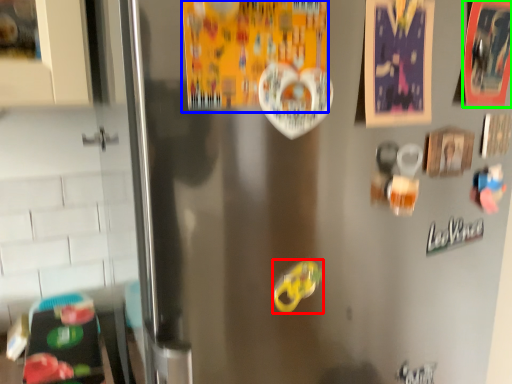
Question: Which object is positioned closest to food (highlighted by a red box)? Select from postcard (highlighted by a blue box) and postcard (highlighted by a green box).

Choices:
 (A) postcard
 (B) postcard

Answer: (A)